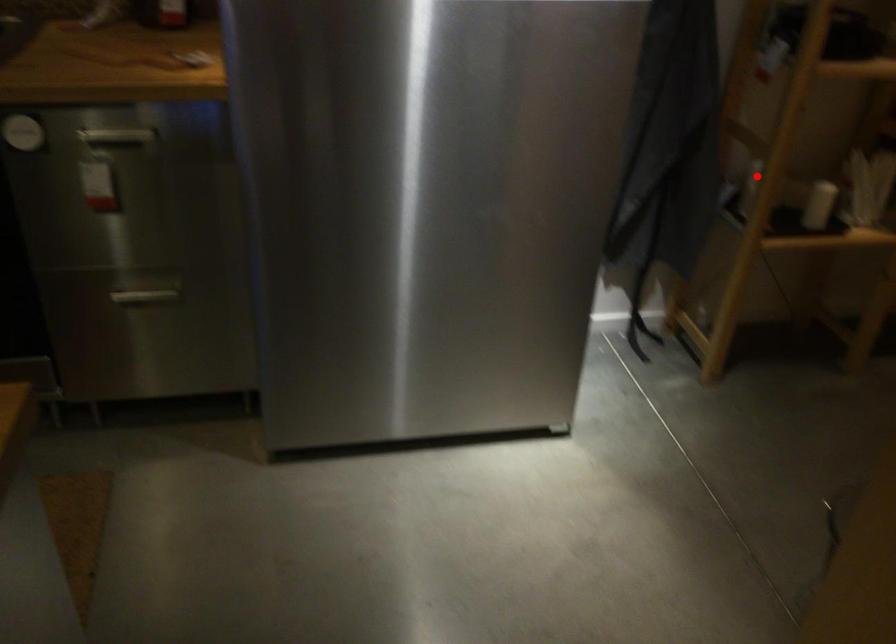
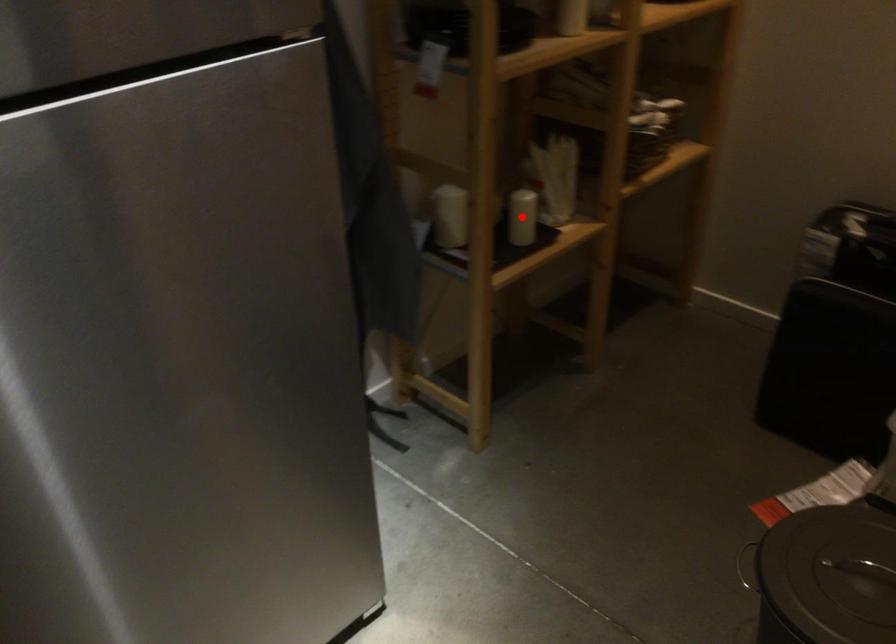
I am providing you with two images of the same scene from different viewpoints. A red point is marked on the first image and another point is marked on the second image. Do the highlighted points in image1 and image2 indicate the same real-world spot?

No